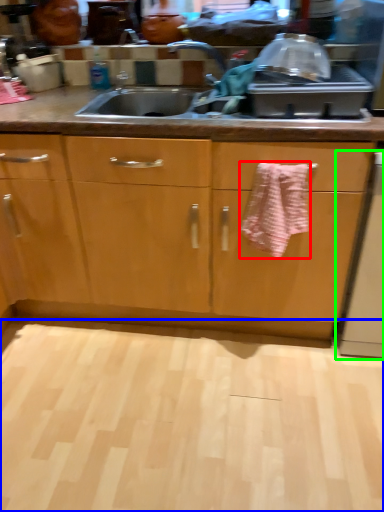
Question: Considering the real-world distances, which object is farthest from bath towel (highlighted by a red box)? plain (highlighted by a blue box) or dish washer (highlighted by a green box)?

Choices:
 (A) plain
 (B) dish washer

Answer: (A)